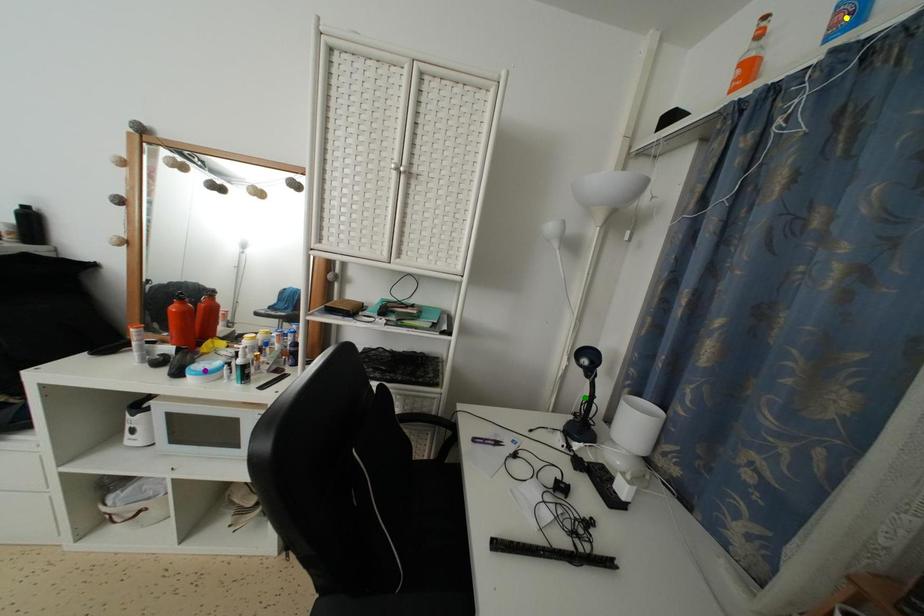
Order these from nearest to farthest:
yellow point | purple point | green point

yellow point
purple point
green point